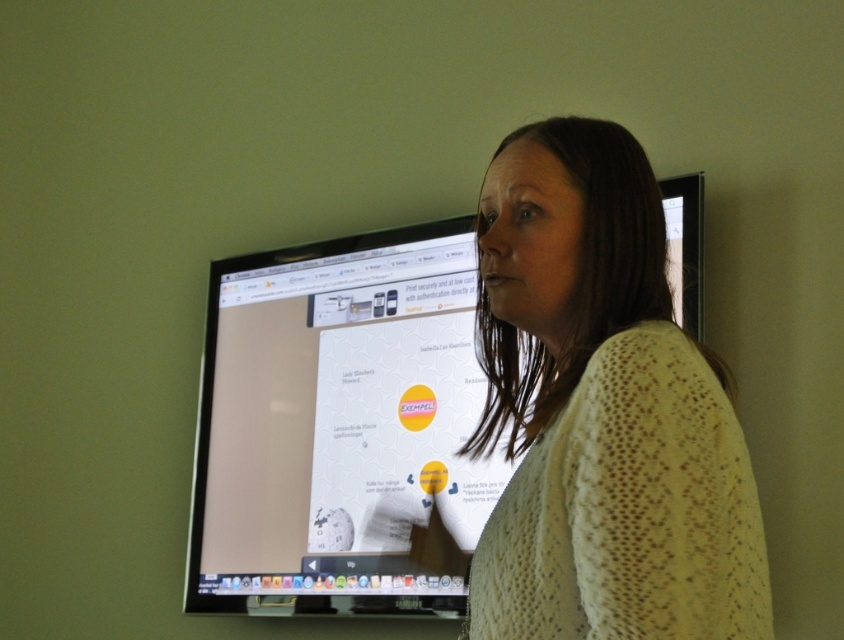
Question: Which point is farther to the camera?

Choices:
 (A) knitted yellow sweater at center
 (B) matte black monitor at center

Answer: (B)

Question: Is knitted yellow sweater at center below matte black monitor at center?

Choices:
 (A) yes
 (B) no

Answer: (B)

Question: Which point is closer to the camera?

Choices:
 (A) knitted yellow sweater at center
 (B) matte black monitor at center

Answer: (A)

Question: Is knitted yellow sweater at center closer to the viewer compared to matte black monitor at center?

Choices:
 (A) no
 (B) yes

Answer: (B)

Question: Does knitted yellow sweater at center appear under matte black monitor at center?

Choices:
 (A) yes
 (B) no

Answer: (B)